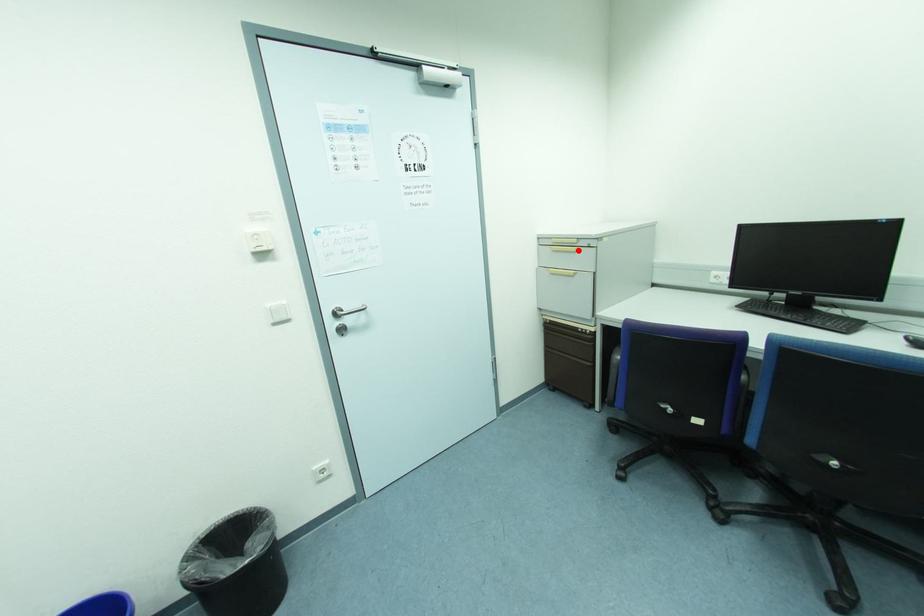
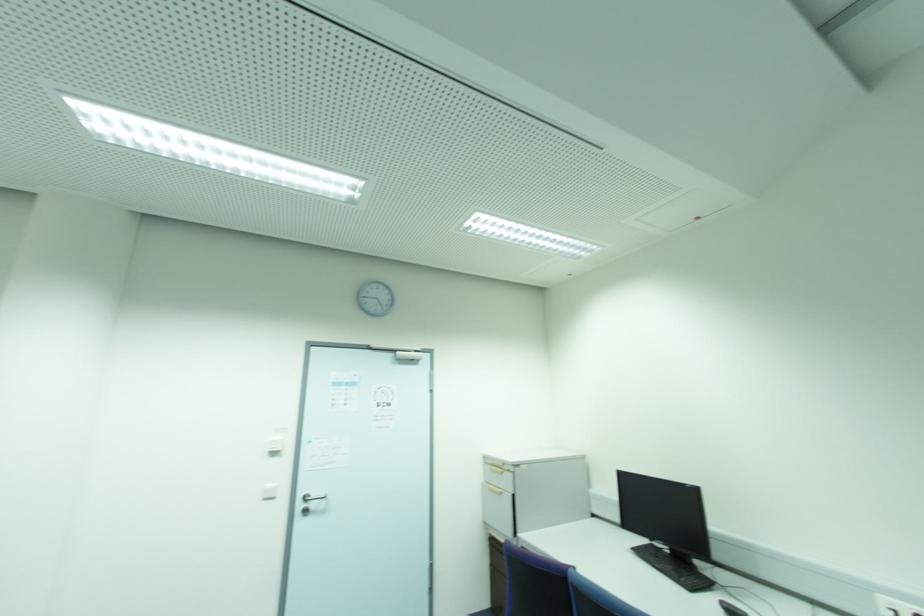
The point at the highlighted location is marked in the first image. Where is the corresponding point in the second image?

(503, 472)